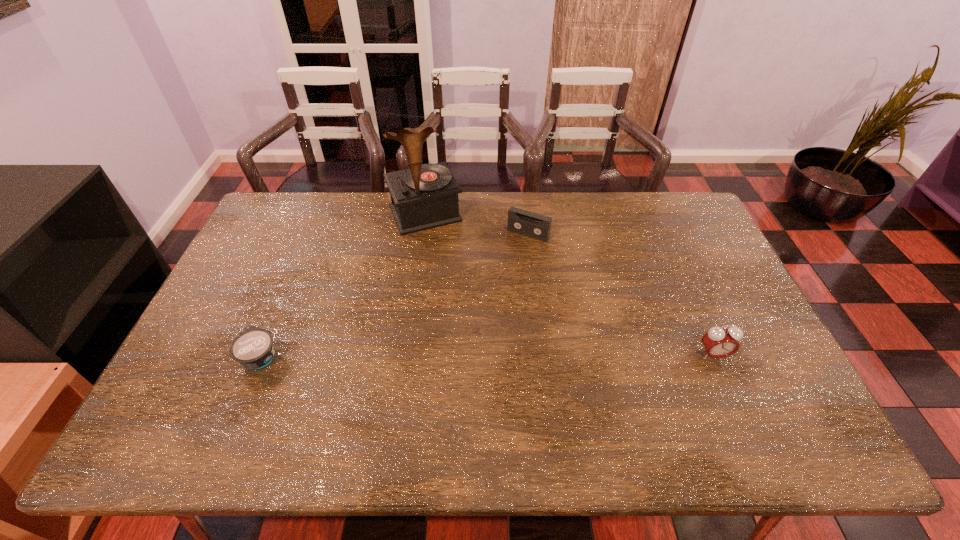
Image resolution: width=960 pixels, height=540 pixels. What are the coordinates of `vacant point located 0.310m on the front-facing side of the videotape` in the screenshot? It's located at (480, 305).

Where is `free point located 0.290m on the front-facing side of the videotape`? The image size is (960, 540). free point located 0.290m on the front-facing side of the videotape is located at coordinates (483, 301).

Identify the location of free space located on the front-facing side of the videotape. (512, 254).

In order to click on vacant space located at the horn opening of the second object from left to right in this screenshot , I will do `click(463, 292)`.

At what (x,y) coordinates should I click in order to perform the action: click on free space located 0.370m at the horn opening of the second object from left to right. Please return your answer as a coordinate pair (x, y). The height and width of the screenshot is (540, 960). Looking at the image, I should click on (473, 314).

The image size is (960, 540). In order to click on vacant region located at the horn opening of the second object from left to right in this screenshot , I will do `click(471, 309)`.

Where is `videotape located at the far edge`? This screenshot has height=540, width=960. videotape located at the far edge is located at coordinates (520, 221).

At what (x,y) coordinates should I click in order to perform the action: click on phonograph_record located in the far edge section of the desktop. Please return your answer as a coordinate pair (x, y). Image resolution: width=960 pixels, height=540 pixels. Looking at the image, I should click on (425, 196).

In order to click on object that is at the left edge in this screenshot , I will do `click(253, 348)`.

Find the location of a particular element. The image size is (960, 540). object that is at the right edge is located at coordinates (719, 342).